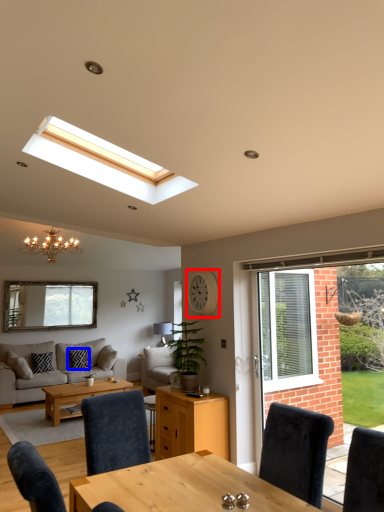
Question: Among these objects, which one is nearest to the camera, clock (highlighted by a red box) or pillow (highlighted by a blue box)?

Choices:
 (A) clock
 (B) pillow

Answer: (A)